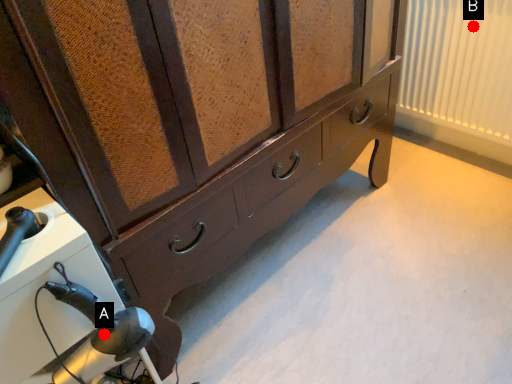
Question: Two points are circled on the image, labeled by A and B beside each circle. Which point is farther to the camera?

Choices:
 (A) A is further
 (B) B is further

Answer: (B)